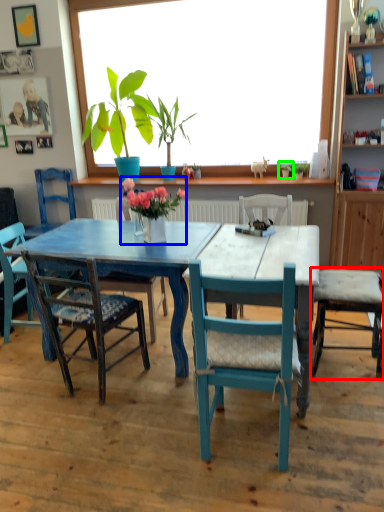
Question: Which is nearer to the chair (highlighted by a red box)? houseplant (highlighted by a blue box) or houseplant (highlighted by a green box).

Choices:
 (A) houseplant
 (B) houseplant

Answer: (A)